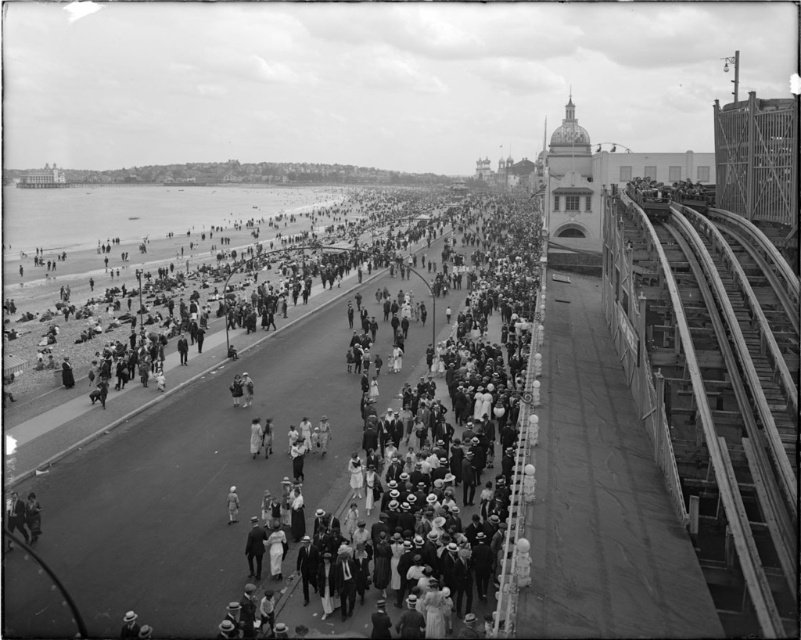
You are standing on the promenade and want to take a photo of both the point at coordinates point (123, 496) and point (725, 596). Which point should you focus on first to ensure both are in focus?

You should focus on point (123, 496) first because it is closer to you than point (725, 596), which is further away. This way, both points will be in focus as the closer point sets the focal plane.

You are standing on the promenade and want to reach the beach. There is a white cotton dress at center and a smooth metal train track at right in your view. Which object should you move towards to get to the beach more quickly?

The white cotton dress at center is to the left of the smooth metal train track at right. Since the beach is to the left of the promenade, moving towards the white cotton dress at center would lead you closer to the beach faster.